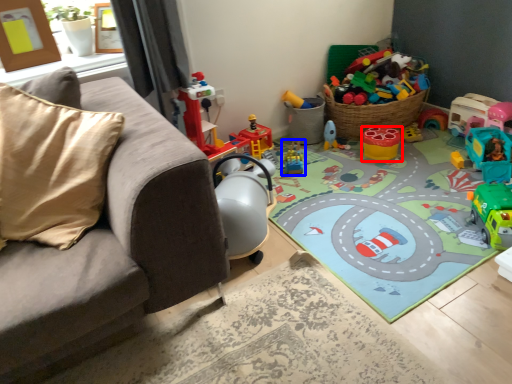
Question: Which object is closer to the camera taking this photo, toy (highlighted by a red box) or toy (highlighted by a blue box)?

Choices:
 (A) toy
 (B) toy

Answer: (B)